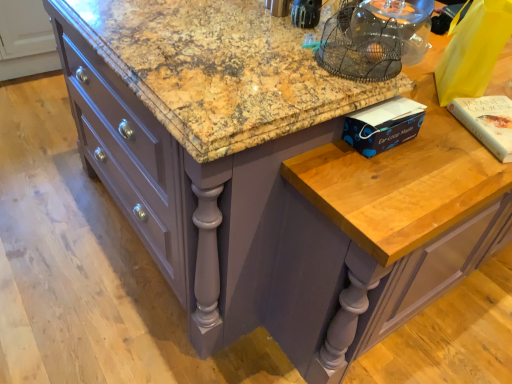
Question: Could you tell me if white paper book at upper right, the first book when ordered from right to left, is facing blue paper ear-loop masks at right, marked as the first book in a left-to-right arrangement?

Choices:
 (A) yes
 (B) no

Answer: (B)

Question: From the image's perspective, does white paper book at upper right, the second book when ordered from left to right, appear lower than blue paper ear-loop masks at right, which is counted as the second book, starting from the right?

Choices:
 (A) yes
 (B) no

Answer: (B)

Question: Can we say white paper book at upper right, the first book when ordered from right to left, lies outside blue paper ear-loop masks at right, marked as the first book in a left-to-right arrangement?

Choices:
 (A) yes
 (B) no

Answer: (A)

Question: Is white paper book at upper right, the first book when ordered from right to left, shorter than blue paper ear-loop masks at right, marked as the first book in a left-to-right arrangement?

Choices:
 (A) no
 (B) yes

Answer: (B)

Question: Does white paper book at upper right, the second book when ordered from left to right, have a lesser width compared to blue paper ear-loop masks at right, which is counted as the second book, starting from the right?

Choices:
 (A) no
 (B) yes

Answer: (A)

Question: Does white paper book at upper right, the first book when ordered from right to left, have a larger size compared to blue paper ear-loop masks at right, which is counted as the second book, starting from the right?

Choices:
 (A) no
 (B) yes

Answer: (A)

Question: Considering the relative sizes of blue paper ear-loop masks at right, marked as the first book in a left-to-right arrangement, and white paper book at upper right, the first book when ordered from right to left, in the image provided, is blue paper ear-loop masks at right, marked as the first book in a left-to-right arrangement, bigger than white paper book at upper right, the first book when ordered from right to left,?

Choices:
 (A) yes
 (B) no

Answer: (A)

Question: Are blue paper ear-loop masks at right, marked as the first book in a left-to-right arrangement, and white paper book at upper right, the second book when ordered from left to right, far apart?

Choices:
 (A) yes
 (B) no

Answer: (B)

Question: Is blue paper ear-loop masks at right, marked as the first book in a left-to-right arrangement, turned away from white paper book at upper right, the second book when ordered from left to right?

Choices:
 (A) no
 (B) yes

Answer: (B)

Question: From the image's perspective, does blue paper ear-loop masks at right, which is counted as the second book, starting from the right, appear lower than white paper book at upper right, the first book when ordered from right to left?

Choices:
 (A) no
 (B) yes

Answer: (B)

Question: Does blue paper ear-loop masks at right, which is counted as the second book, starting from the right, have a greater width compared to white paper book at upper right, the first book when ordered from right to left?

Choices:
 (A) no
 (B) yes

Answer: (A)

Question: Is blue paper ear-loop masks at right, marked as the first book in a left-to-right arrangement, further to the viewer compared to white paper book at upper right, the second book when ordered from left to right?

Choices:
 (A) yes
 (B) no

Answer: (B)

Question: Is blue paper ear-loop masks at right, which is counted as the second book, starting from the right, bigger or smaller than white paper book at upper right, the first book when ordered from right to left?

Choices:
 (A) small
 (B) big

Answer: (B)